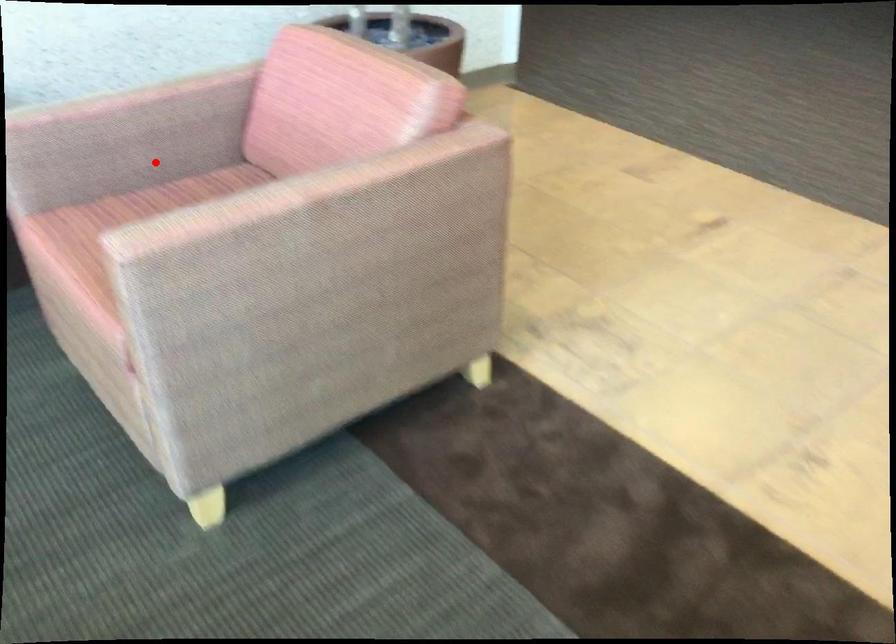
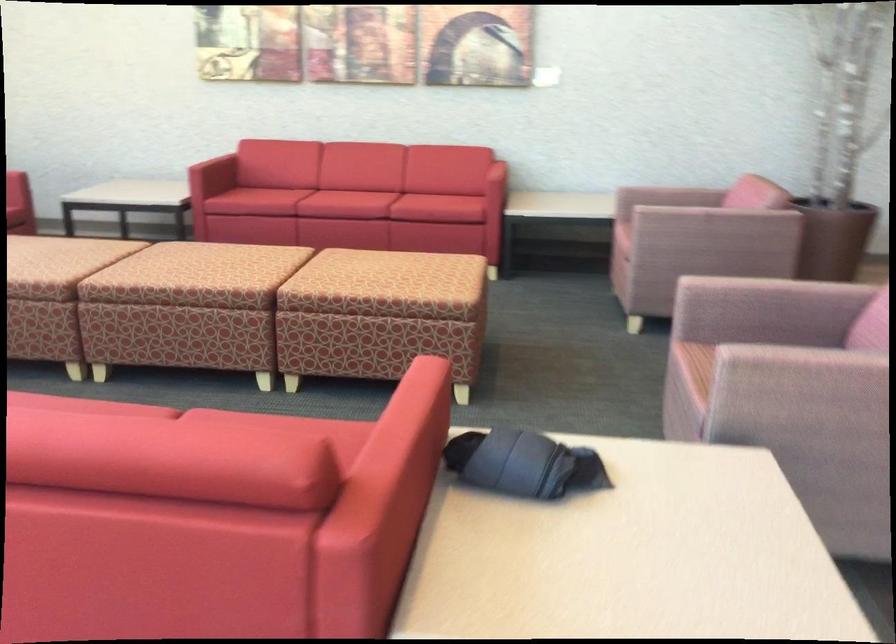
Locate, in the second image, the point that corresponds to the highlighted location in the first image.

(669, 196)